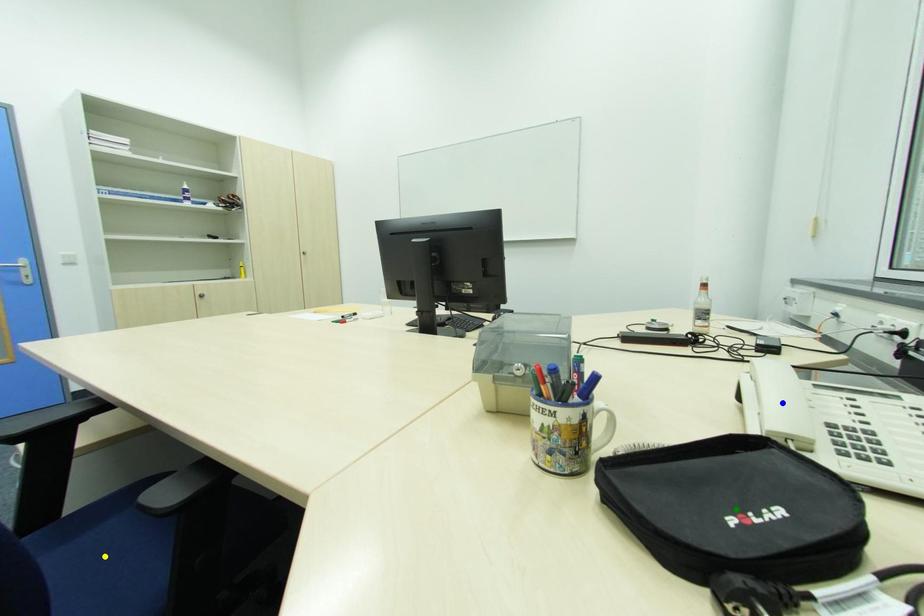
Order these from nearest to farthest:
1. blue point
2. green point
3. yellow point

green point, blue point, yellow point